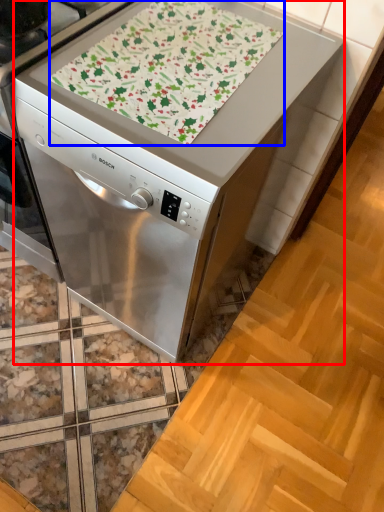
Question: Among these objects, which one is nearest to the camera, home appliance (highlighted by a red box) or blanket (highlighted by a blue box)?

Choices:
 (A) home appliance
 (B) blanket

Answer: (A)